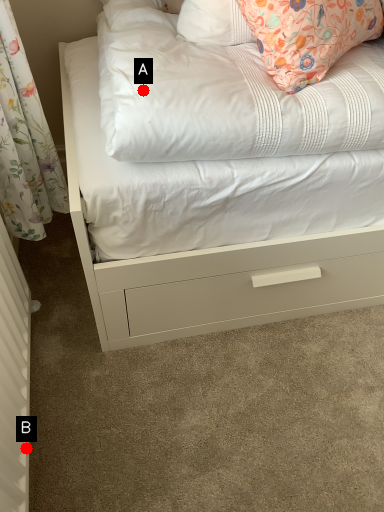
Question: Two points are circled on the image, labeled by A and B beside each circle. Which point is farther to the camera?

Choices:
 (A) A is further
 (B) B is further

Answer: (B)